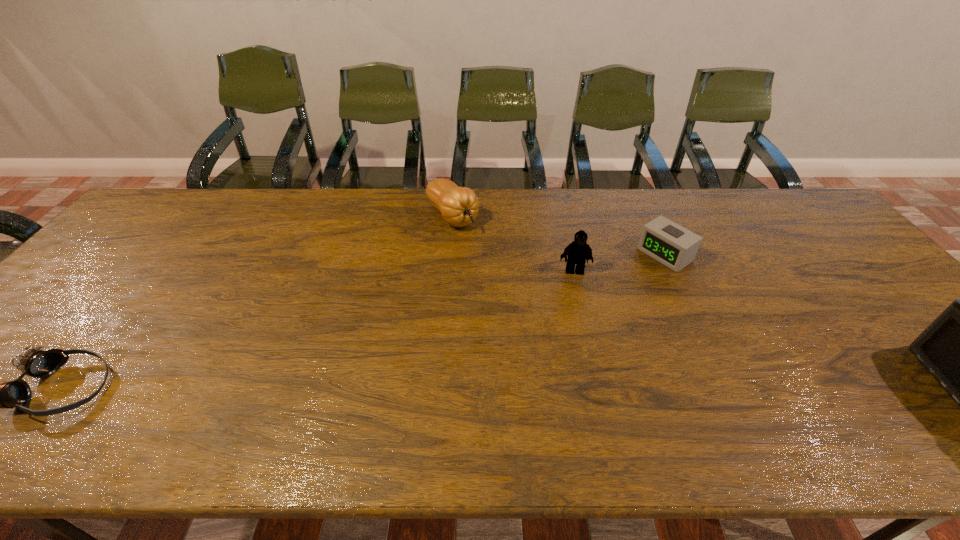
In the image, there is a desktop. Identify the location of vacant space at the far right corner. (754, 193).

Locate an element on the screen. The height and width of the screenshot is (540, 960). vacant area that lies between the second object from right to left and the second object from left to right is located at coordinates (559, 235).

The width and height of the screenshot is (960, 540). Find the location of `free area in between the third object from left to right and the fourth object from left to right`. free area in between the third object from left to right and the fourth object from left to right is located at coordinates (619, 263).

Find the location of a particular element. vacant space that's between the third object from right to left and the fourth object from right to left is located at coordinates (514, 244).

At what (x,y) coordinates should I click in order to perform the action: click on free point between the gourd and the Lego. Please return your answer as a coordinate pair (x, y). This screenshot has width=960, height=540. Looking at the image, I should click on (514, 244).

The width and height of the screenshot is (960, 540). Identify the location of object that ranks as the second closest to the leftmost object. (578, 251).

This screenshot has height=540, width=960. Find the location of `the third closest object relative to the third object from left to right`. the third closest object relative to the third object from left to right is located at coordinates (959, 348).